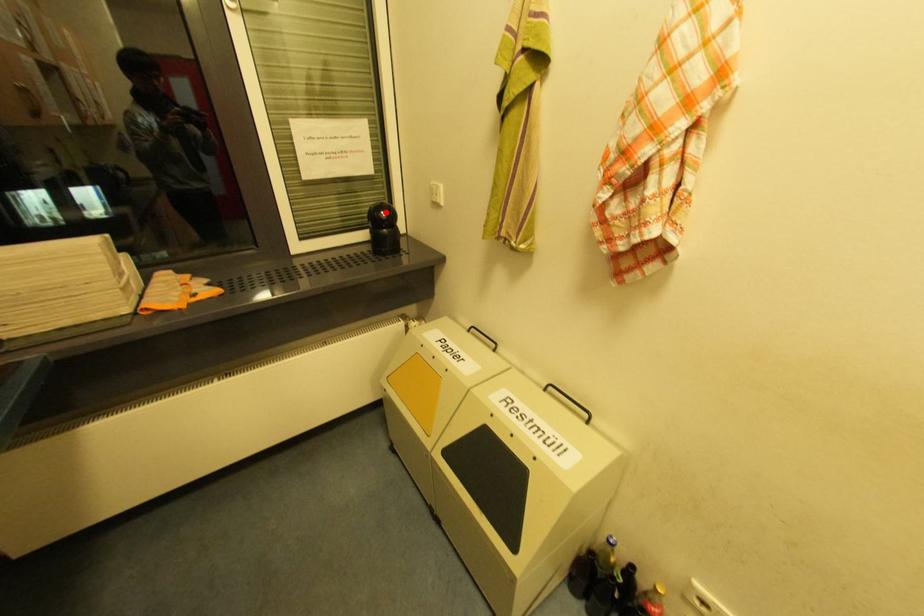
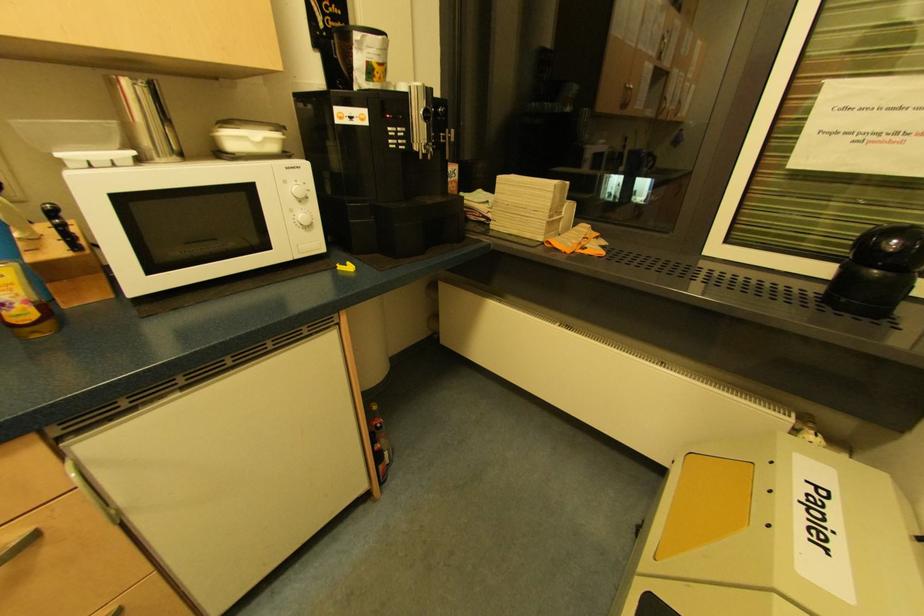
Question: I am providing you with two images of the same scene from different viewpoints. In image1, a red point is highlighted. Considering the same 3D point in image2, which of the following is correct?

Choices:
 (A) It is closer
 (B) It is farther

Answer: (B)